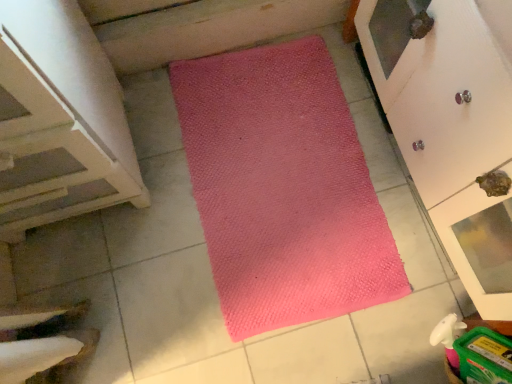
The width and height of the screenshot is (512, 384). Find the location of `free location in front of white wood stairs at left`. free location in front of white wood stairs at left is located at coordinates (99, 293).